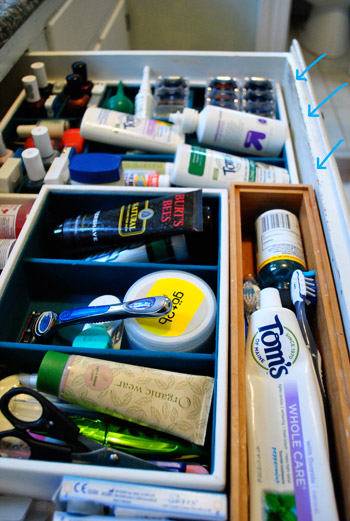
Where is `shaving items`? shaving items is located at coordinates (65, 316), (172, 84), (220, 88), (259, 91).